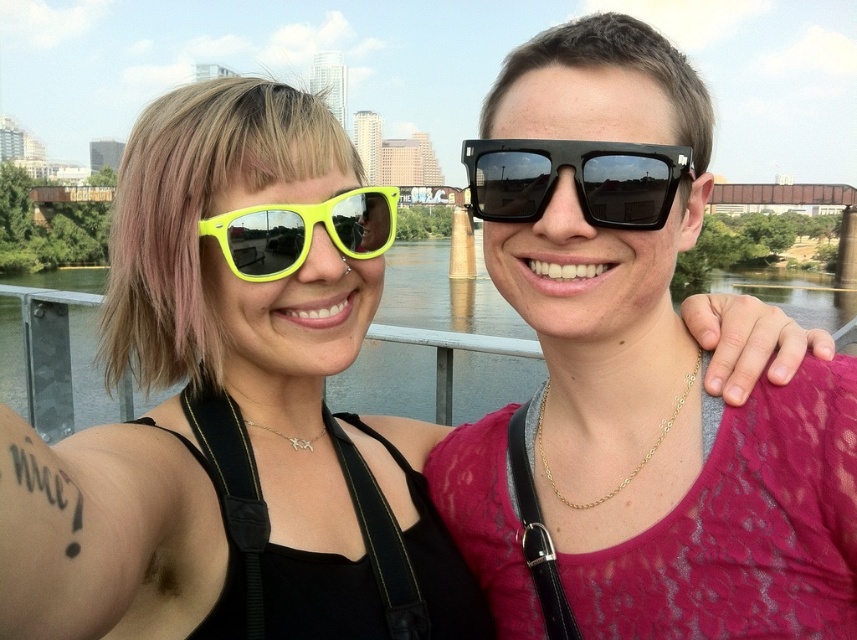
Can you confirm if neon yellow plastic sunglasses at upper left is bigger than greenish water at center?

Incorrect, neon yellow plastic sunglasses at upper left is not larger than greenish water at center.

Between neon yellow plastic sunglasses at upper left and greenish water at center, which one appears on the right side from the viewer's perspective?

Positioned to the right is greenish water at center.

Which is behind, point (250, 314) or point (88, 330)?

The point (88, 330) is behind.

I want to click on neon yellow plastic sunglasses at upper left, so pyautogui.click(x=234, y=406).

Does matte black sunglasses at center lie in front of black reflective sunglasses at center?

Yes, matte black sunglasses at center is closer to the viewer.

Identify the location of matte black sunglasses at center. The width and height of the screenshot is (857, 640). (634, 376).

Is black reflective sunglasses at center to the left of neon yellow plastic sunglasses at center from the viewer's perspective?

No, black reflective sunglasses at center is not to the left of neon yellow plastic sunglasses at center.

Is black reflective sunglasses at center wider than neon yellow plastic sunglasses at center?

Correct, the width of black reflective sunglasses at center exceeds that of neon yellow plastic sunglasses at center.

Where is `black reflective sunglasses at center`? The width and height of the screenshot is (857, 640). black reflective sunglasses at center is located at coordinates (574, 179).

Locate an element on the screen. The height and width of the screenshot is (640, 857). black reflective sunglasses at center is located at coordinates (574, 179).